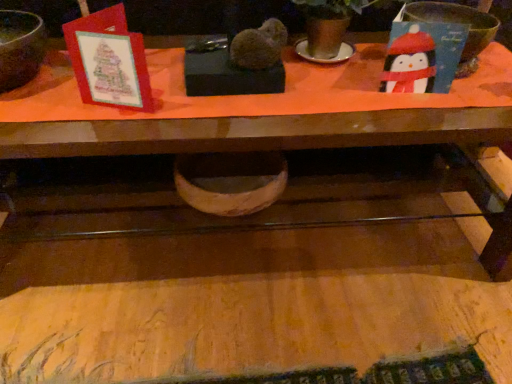
Question: From a real-world perspective, does matte black bowl at right, which is the 2th basin from left to right, stand above wooden table at lower center?

Choices:
 (A) yes
 (B) no

Answer: (A)

Question: From a real-world perspective, is matte black bowl at right, the 1th basin from the top, located beneath wooden table at lower center?

Choices:
 (A) yes
 (B) no

Answer: (B)

Question: From the image's perspective, is matte black bowl at right, the 1th basin from the top, on wooden table at lower center?

Choices:
 (A) yes
 (B) no

Answer: (A)

Question: Considering the relative sizes of matte black bowl at right, positioned as the 1th basin in right-to-left order, and wooden table at lower center in the image provided, is matte black bowl at right, positioned as the 1th basin in right-to-left order, thinner than wooden table at lower center?

Choices:
 (A) yes
 (B) no

Answer: (B)

Question: Does matte black bowl at right, positioned as the 1th basin in right-to-left order, touch wooden table at lower center?

Choices:
 (A) no
 (B) yes

Answer: (A)

Question: From a real-world perspective, is matte brown mixing bowl at upper left positioned above or below matte black bowl at right, positioned as the 1th basin in right-to-left order?

Choices:
 (A) above
 (B) below

Answer: (A)

Question: Is point (13, 81) positioned closer to the camera than point (465, 49)?

Choices:
 (A) farther
 (B) closer

Answer: (B)

Question: Is matte brown mixing bowl at upper left bigger or smaller than matte black bowl at right, the 1th basin from the top?

Choices:
 (A) big
 (B) small

Answer: (A)

Question: Based on their positions, is matte brown mixing bowl at upper left located to the left or right of matte black bowl at right, placed as the second basin when sorted from bottom to top?

Choices:
 (A) left
 (B) right

Answer: (A)

Question: From the image's perspective, relative to wooden bowl at center, positioned as the first basin in left-to-right order, is matte brown mixing bowl at upper left above or below?

Choices:
 (A) below
 (B) above

Answer: (B)

Question: From their relative heights in the image, would you say matte brown mixing bowl at upper left is taller or shorter than wooden bowl at center, acting as the 1th basin starting from the bottom?

Choices:
 (A) tall
 (B) short

Answer: (A)

Question: From a real-world perspective, is matte brown mixing bowl at upper left positioned above or below wooden bowl at center, acting as the 1th basin starting from the bottom?

Choices:
 (A) below
 (B) above

Answer: (B)

Question: Looking at their shapes, would you say matte brown mixing bowl at upper left is wider or thinner than wooden bowl at center, positioned as the second basin in right-to-left order?

Choices:
 (A) wide
 (B) thin

Answer: (B)

Question: Choose the correct answer: Is wooden bowl at center, acting as the 1th basin starting from the bottom, inside matte black bowl at right, positioned as the 1th basin in right-to-left order, or outside it?

Choices:
 (A) inside
 (B) outside

Answer: (B)

Question: Considering the relative positions of wooden bowl at center, acting as the 1th basin starting from the bottom, and matte black bowl at right, placed as the second basin when sorted from bottom to top, in the image provided, is wooden bowl at center, acting as the 1th basin starting from the bottom, to the left or to the right of matte black bowl at right, placed as the second basin when sorted from bottom to top,?

Choices:
 (A) left
 (B) right

Answer: (A)